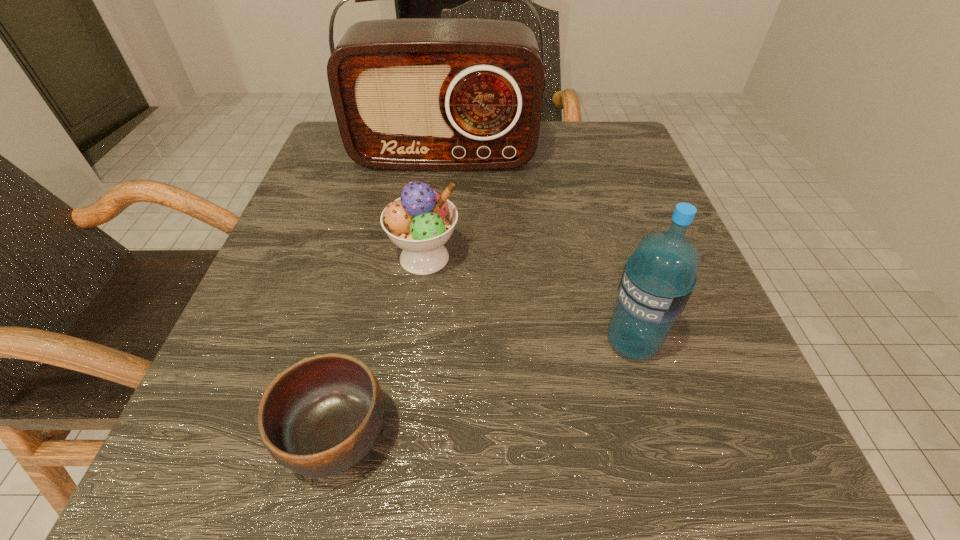
In the image, there is a desktop. In order to click on vacant space at the near edge in this screenshot , I will do `click(400, 474)`.

In the image, there is a desktop. At what (x,y) coordinates should I click in order to perform the action: click on free space at the left edge. Please return your answer as a coordinate pair (x, y). Looking at the image, I should click on click(215, 430).

The width and height of the screenshot is (960, 540). Find the location of `vacant space at the right edge of the desktop`. vacant space at the right edge of the desktop is located at coordinates (619, 258).

This screenshot has width=960, height=540. What are the coordinates of `free space at the far left corner` in the screenshot? It's located at (321, 178).

Where is `vacant space at the near left corner of the desktop`? The width and height of the screenshot is (960, 540). vacant space at the near left corner of the desktop is located at coordinates (287, 511).

Find the location of a particular element. free space at the near right corner is located at coordinates (774, 504).

The height and width of the screenshot is (540, 960). Find the location of `vacant space in between the farthest object and the water bottle`. vacant space in between the farthest object and the water bottle is located at coordinates (538, 249).

Image resolution: width=960 pixels, height=540 pixels. I want to click on unoccupied position between the bowl and the third nearest object, so click(x=380, y=347).

In order to click on empty location between the water bottle and the bowl in this screenshot , I will do `click(484, 390)`.

Locate an element on the screen. free space between the third tallest object and the second nearest object is located at coordinates (528, 300).